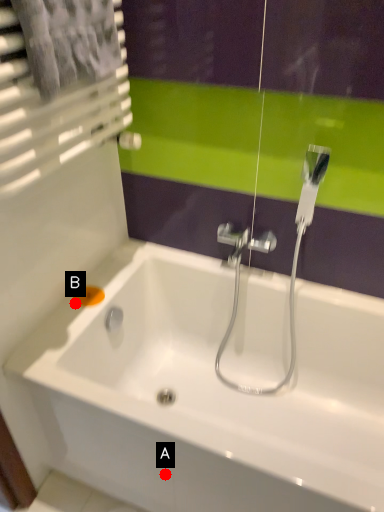
Question: Two points are circled on the image, labeled by A and B beside each circle. Among these points, which one is nearest to the camera?

Choices:
 (A) A is closer
 (B) B is closer

Answer: (A)